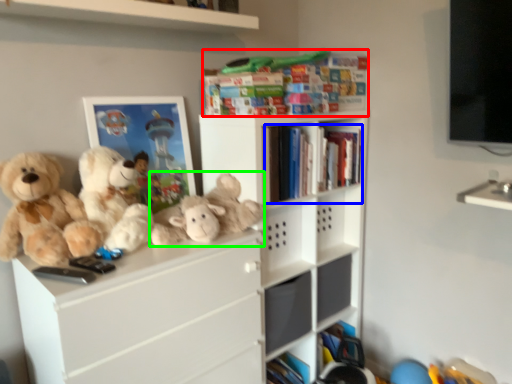
Question: Estimate the real-world distances between objects in this image. Which object is closer to book (highlighted by a red box), book (highlighted by a blue box) or toy (highlighted by a green box)?

Choices:
 (A) book
 (B) toy

Answer: (A)